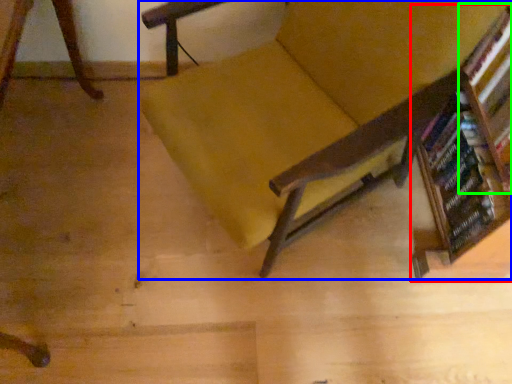
Question: Which object is the farthest from bookcase (highlighted by a red box)? Choose among these: chair (highlighted by a blue box) or shelf (highlighted by a green box).

Choices:
 (A) chair
 (B) shelf

Answer: (A)